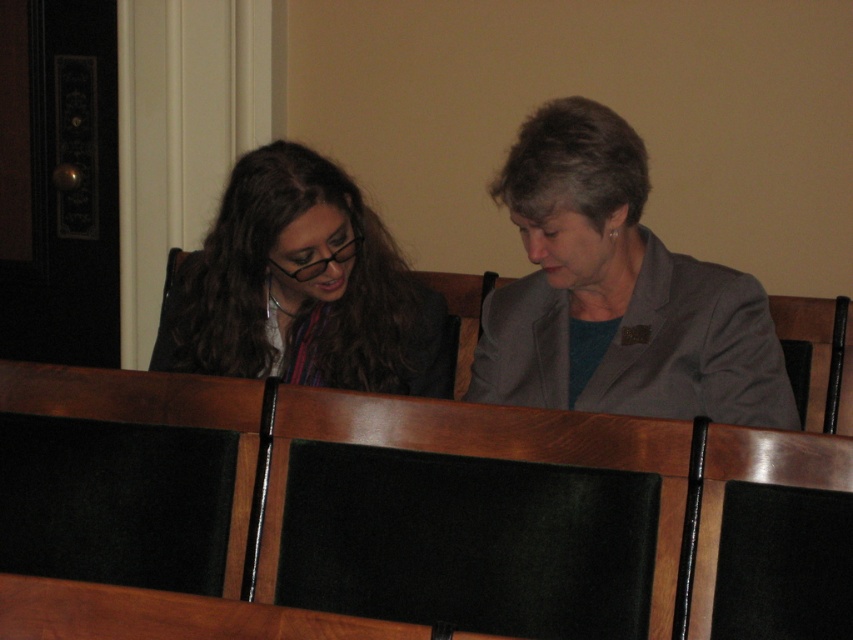
You are standing in front of the beige wall and want to place a small decoration exactly at the point marked as point (616, 292). What object will the decoration land on?

The decoration will land on the gray fabric jacket at center because the point (616, 292) is located on it.

You are standing in front of the two people sitting at the center of the image. You want to hand a book to the wooden table at center without touching the gray fabric jacket at center. Is this possible?

The gray fabric jacket at center is further to the viewer than the wooden table at center, so you can place the book on the wooden table at center without touching the jacket.